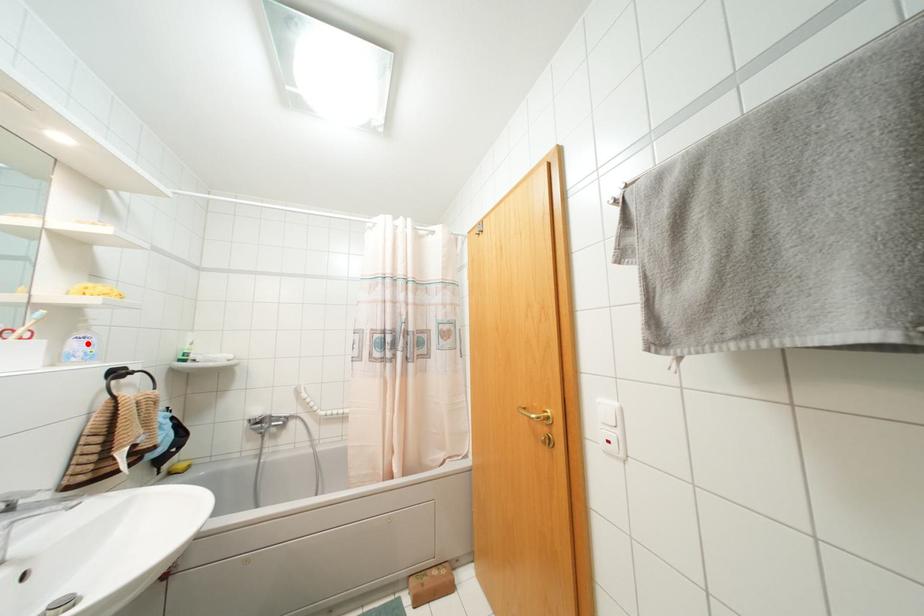
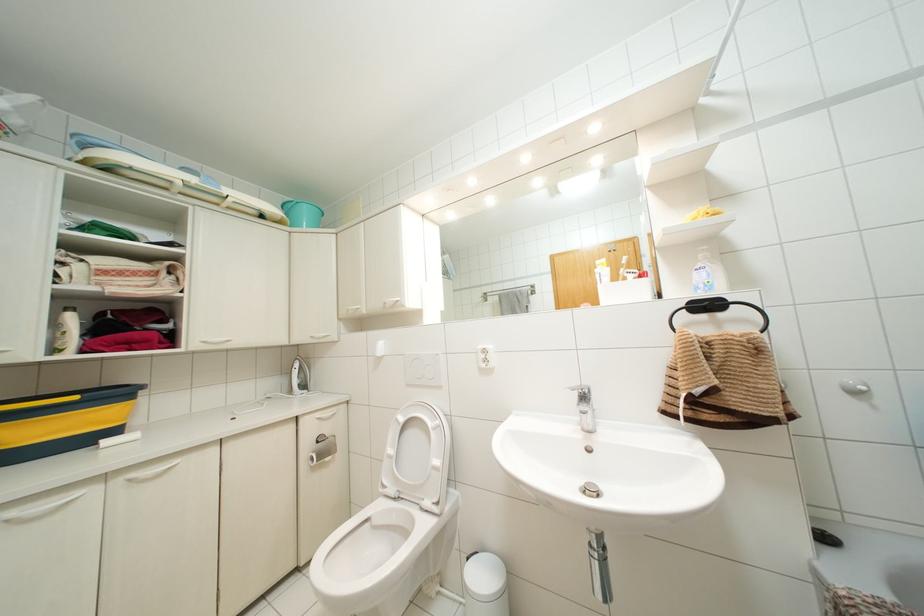
Question: I am providing you with two images of the same scene from different viewpoints. A red point is marked on the first image. At the location where the point appears in image 1, is it still visible in image 2?

Choices:
 (A) Yes
 (B) No

Answer: (A)